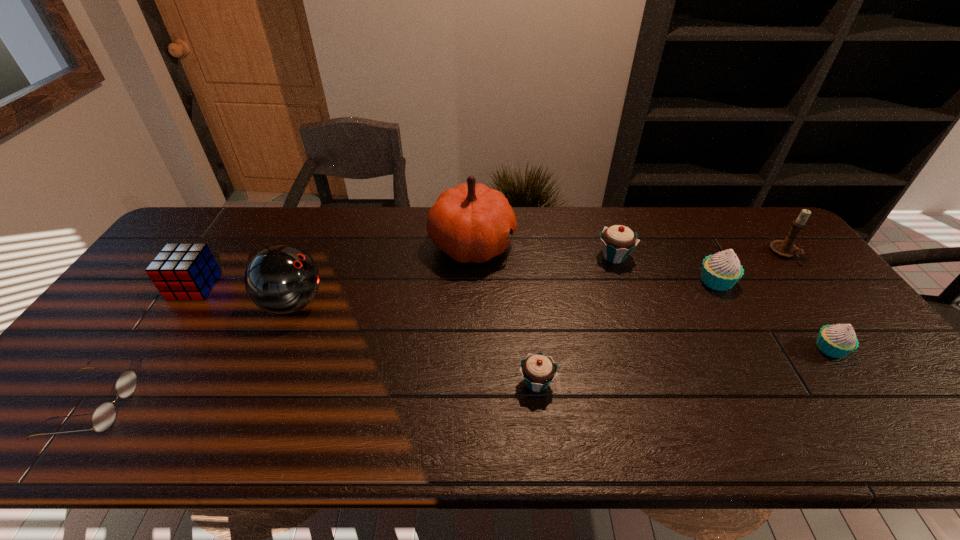
I want to click on the rightmost cupcake, so click(839, 340).

Identify the location of the second nearest cupcake. The image size is (960, 540). (839, 340).

I want to click on the left teal cupcake, so click(x=538, y=370).

Locate an element on the screen. the nearest cupcake is located at coordinates (538, 370).

The height and width of the screenshot is (540, 960). What are the coordinates of `spectacles` in the screenshot? It's located at (103, 417).

Find the location of a particular element. gold spectacles is located at coordinates (103, 417).

Identify the location of vacant space located on the front-facing side of the pumpkin. The height and width of the screenshot is (540, 960). (560, 244).

The image size is (960, 540). I want to click on free space located 0.150m on the surface of the black bowling ball near the finger holes, so click(379, 303).

Locate an element on the screen. The height and width of the screenshot is (540, 960). vacant space situated on the side of the candle holder with the handle is located at coordinates (826, 306).

Where is `vacant space located on the left of the farther white cupcake`? This screenshot has width=960, height=540. vacant space located on the left of the farther white cupcake is located at coordinates (582, 281).